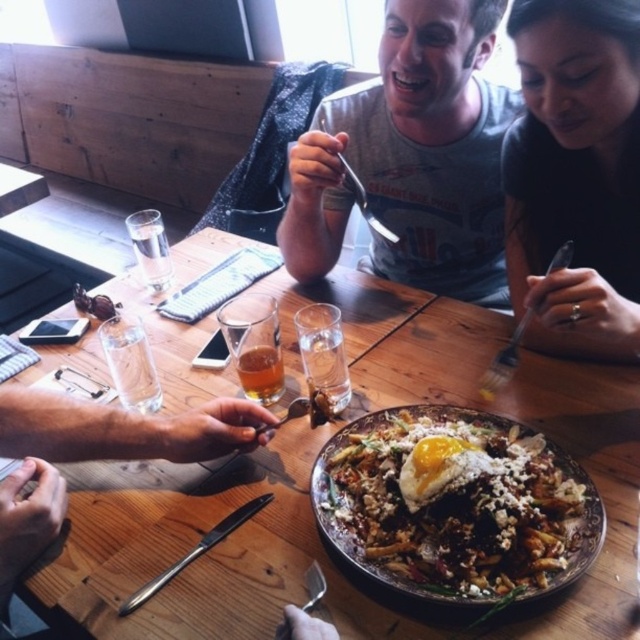
Is wooden table at center to the right of black matte fork at upper right from the viewer's perspective?

Incorrect, wooden table at center is not on the right side of black matte fork at upper right.

Can you confirm if wooden table at center is wider than black matte fork at upper right?

Correct, the width of wooden table at center exceeds that of black matte fork at upper right.

Between point (628, 486) and point (522, 220), which one is positioned in front?

Point (628, 486)

Identify the location of wooden table at center. Image resolution: width=640 pixels, height=640 pixels. (308, 497).

Can you confirm if gray cotton t-shirt at center is positioned above golden fried egg at center?

Correct, gray cotton t-shirt at center is located above golden fried egg at center.

Between point (394, 276) and point (454, 435), which one is positioned behind?

The point (394, 276) is more distant.

This screenshot has width=640, height=640. I want to click on gray cotton t-shirt at center, so click(412, 157).

Find the location of `gray cotton t-shirt at center`. gray cotton t-shirt at center is located at coordinates (412, 157).

Does black matte fork at upper right appear on the left side of translucent glass beer at center?

Incorrect, black matte fork at upper right is not on the left side of translucent glass beer at center.

Who is more distant from viewer, (582, 67) or (276, 371)?

The point (276, 371) is more distant.

Locate an element on the screen. This screenshot has height=640, width=640. black matte fork at upper right is located at coordinates (576, 173).